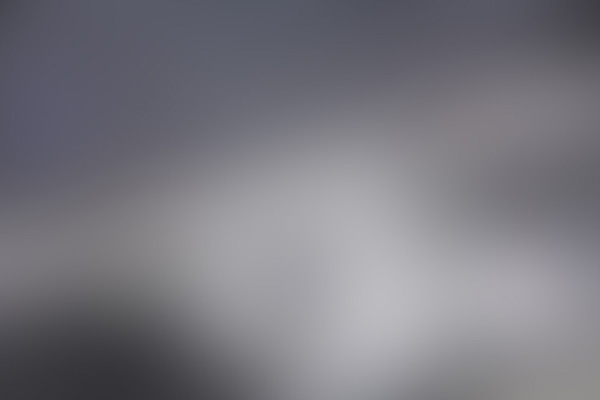
Find the location of a particular element. corner is located at coordinates (1, 1), (596, 0), (596, 397), (3, 395).